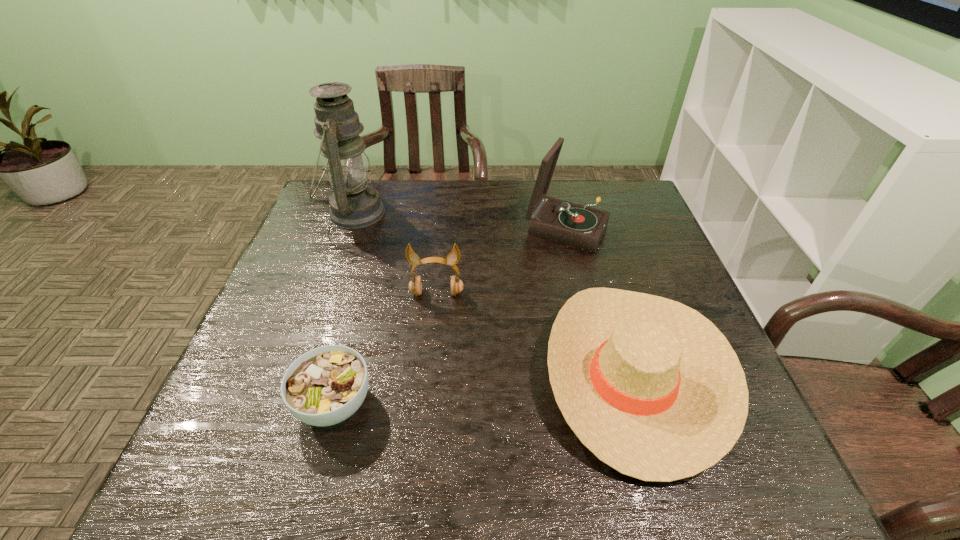
You are a GUI agent. You are given a task and a screenshot of the screen. Output one action in this format:
    pyautogui.click(x=<x>, y=<y>)
    Task: Click on the free space located 0.380m on the right of the shortest object
    
    Given the screenshot: What is the action you would take?
    pyautogui.click(x=565, y=403)

At what (x,y) coordinates should I click in order to perform the action: click on oil lamp that is at the far edge. Please return your answer as a coordinate pair (x, y). Looking at the image, I should click on (353, 204).

Find the location of a particular element. The image size is (960, 540). phonograph record at the far edge is located at coordinates (557, 220).

You are a GUI agent. You are given a task and a screenshot of the screen. Output one action in this format:
    pyautogui.click(x=<x>, y=<y>)
    Task: Click on the object situated at the near edge
    The image size is (960, 540).
    Given the screenshot: What is the action you would take?
    pyautogui.click(x=650, y=386)

This screenshot has width=960, height=540. I want to click on oil lamp that is at the left edge, so click(353, 204).

What are the coordinates of `soup bowl that is positioned at the left edge` in the screenshot? It's located at (326, 385).

Locate an element on the screen. Image resolution: width=960 pixels, height=540 pixels. phonograph record that is at the right edge is located at coordinates (557, 220).

The height and width of the screenshot is (540, 960). I want to click on sunhat that is positioned at the right edge, so click(650, 386).

The width and height of the screenshot is (960, 540). What are the coordinates of `object that is at the far left corner` in the screenshot? It's located at (353, 204).

Image resolution: width=960 pixels, height=540 pixels. Identify the location of object that is at the far right corner. (557, 220).